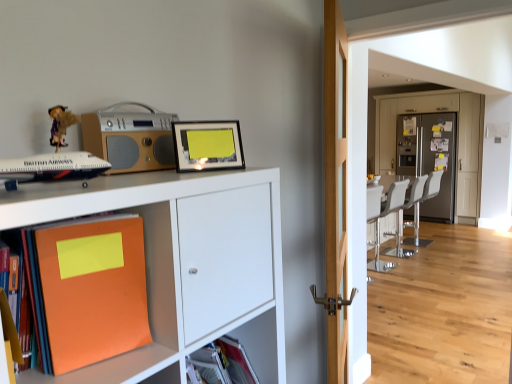
Question: In the image, is white leather swivel chair at center on the left side or the right side of silver metallic stereo at upper left?

Choices:
 (A) left
 (B) right

Answer: (B)

Question: In terms of height, does white leather swivel chair at center look taller or shorter compared to silver metallic stereo at upper left?

Choices:
 (A) short
 (B) tall

Answer: (B)

Question: Considering the real-world distances, which object is closest to the metallic gray refrigerator at center?

Choices:
 (A) matte plastic shelf at lower center
 (B) white leather chair at right
 (C) matte black picture frame at upper center
 (D) silver metallic stereo at upper left
 (E) white leather swivel chair at center

Answer: (B)

Question: Which object is positioned farthest from the white leather chair at right?

Choices:
 (A) matte black airplane at left
 (B) light wood door at center
 (C) metallic gray refrigerator at center
 (D) matte black picture frame at upper center
 (E) orange matte book at lower left, which is the second book in right-to-left order

Answer: (E)